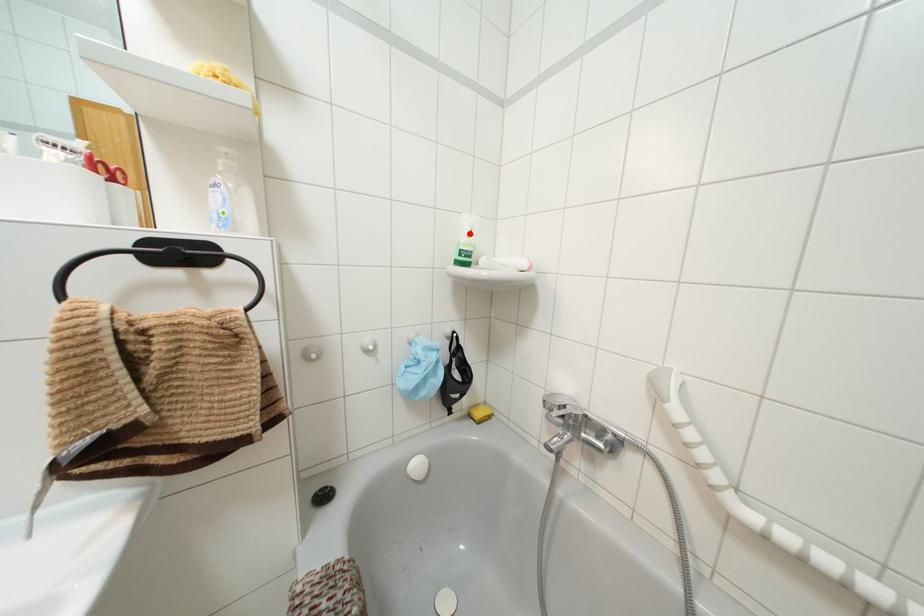
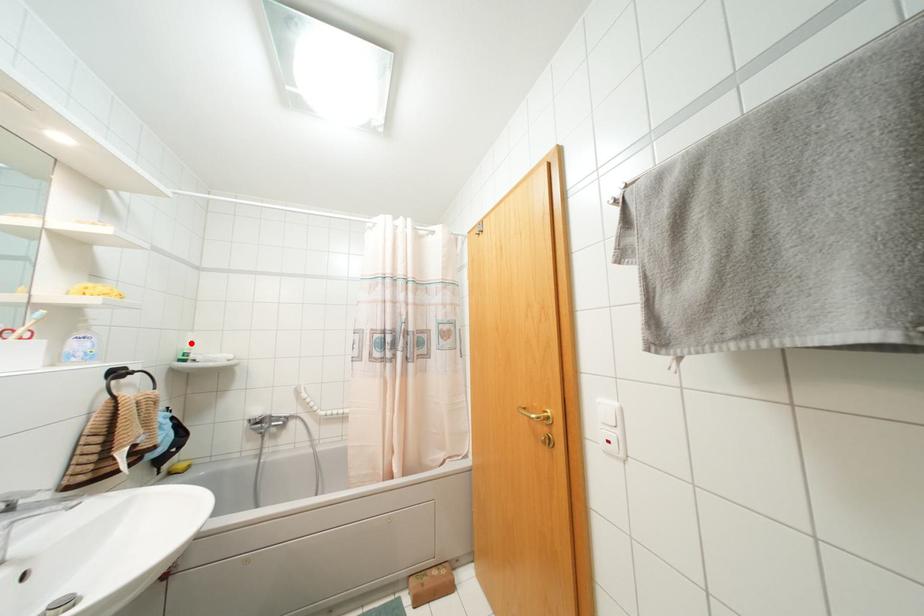
I am providing you with two images of the same scene from different viewpoints. A red point is marked on the first image and another point is marked on the second image. Do the highlighted points in image1 and image2 indicate the same real-world spot?

Yes